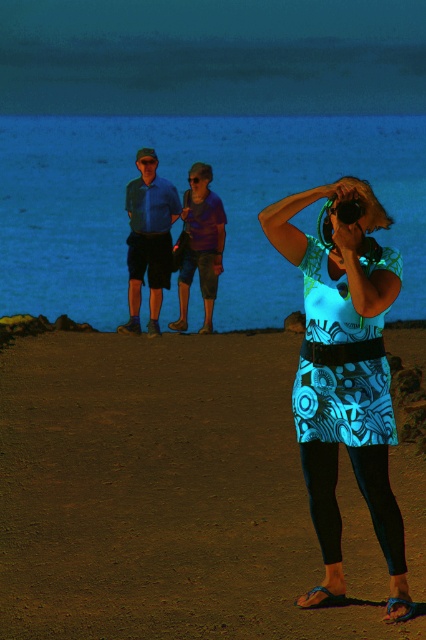
Is blue water at upper center bigger than patterned fabric dress at center?

Yes.

Is blue water at upper center in front of patterned fabric dress at center?

No, blue water at upper center is further to the viewer.

Is point (57, 150) positioned in front of point (385, 264)?

No, it is behind (385, 264).

At what (x,y) coordinates should I click in order to perform the action: click on blue water at upper center. Please return your answer as a coordinate pair (x, y). Looking at the image, I should click on (181, 196).

Is patterned fabric dress at center thinner than blue cotton shirt at center?

Incorrect, patterned fabric dress at center's width is not less than blue cotton shirt at center's.

Between point (379, 209) and point (131, 198), which one is positioned behind?

The point (131, 198) is behind.

Consider the image. Who is more forward, (379, 317) or (140, 291)?

Point (379, 317) is in front.

At what (x,y) coordinates should I click in order to perform the action: click on patterned fabric dress at center. Please return your answer as a coordinate pair (x, y). The width and height of the screenshot is (426, 640). Looking at the image, I should click on (345, 376).

Based on the photo, is blue printed skirt at center positioned behind patterned fabric dress at center?

Yes, it is behind patterned fabric dress at center.

Is blue printed skirt at center taller than patterned fabric dress at center?

Incorrect, blue printed skirt at center's height is not larger of patterned fabric dress at center's.

Does point (189, 438) come in front of point (379, 531)?

No.

Locate an element on the screen. blue printed skirt at center is located at coordinates (169, 496).